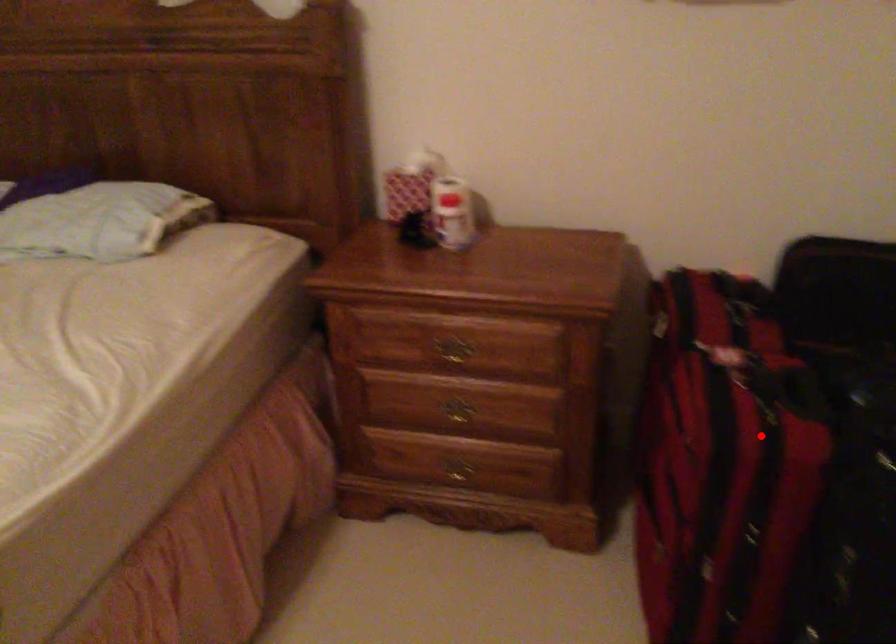
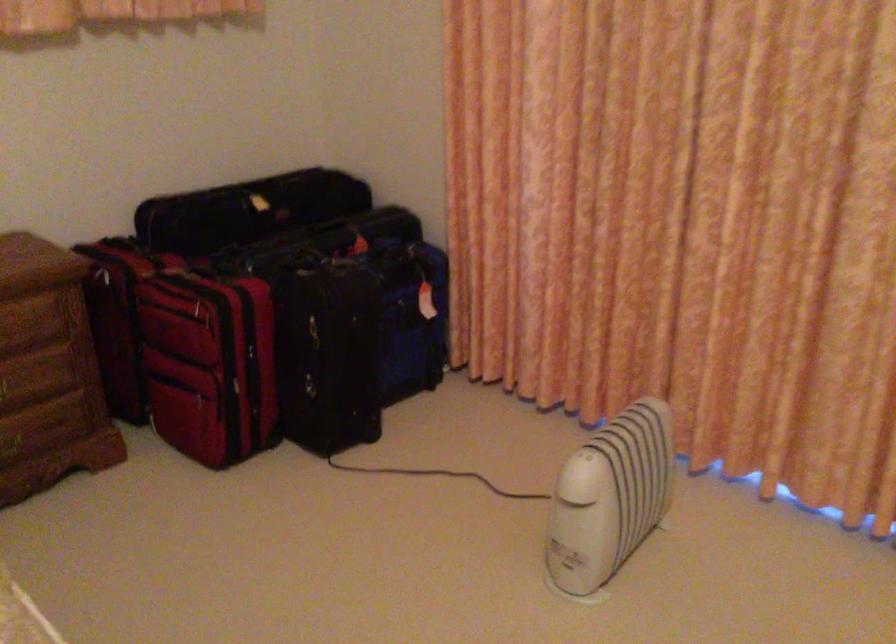
Find the pixel in the second image that matches the highlighted location in the first image.

(243, 292)